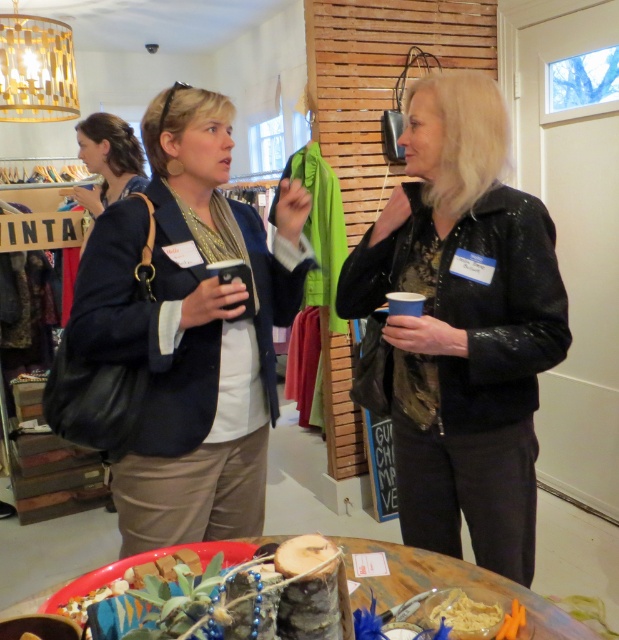
You are a salesperson in the boutique and need to show a customer the location of two jackets. The customer asks, which jacket is closer to the entrance? The entrance is on the left side of the store. You see the black sequined jacket at center and the matte black blazer at left. Based on their positions, which one is closer to the entrance?

The matte black blazer at left is closer to the entrance because it is positioned to the left of the black sequined jacket at center, and the entrance is on the left side of the store.